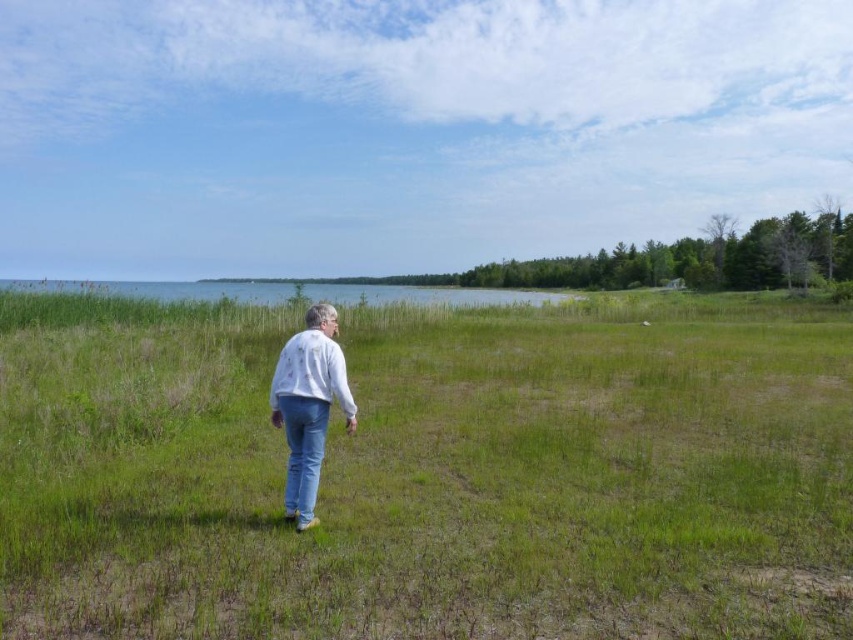
You are standing in the field and want to walk towards the water. Which direction should you move relative to the green grass at center and denim jeans at center?

The green grass at center is to the right of the denim jeans at center, so to walk towards the water, you should move towards the left of the denim jeans at center where the grass is located.

You are standing in the field and see the green grass at center and the white cotton shirt at center. Which object is closer to you?

The green grass at center is closer to you because it is in front of the white cotton shirt at center.